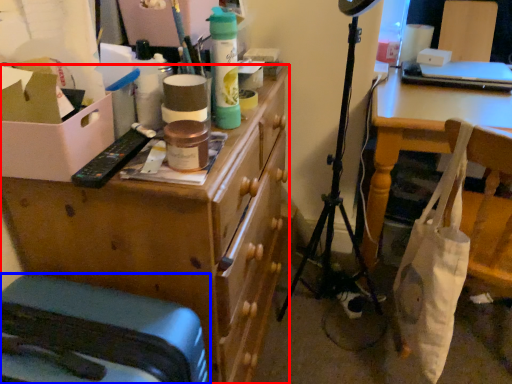
Question: Among these objects, which one is farthest to the camera, desk (highlighted by a red box) or furniture (highlighted by a blue box)?

Choices:
 (A) desk
 (B) furniture

Answer: (A)